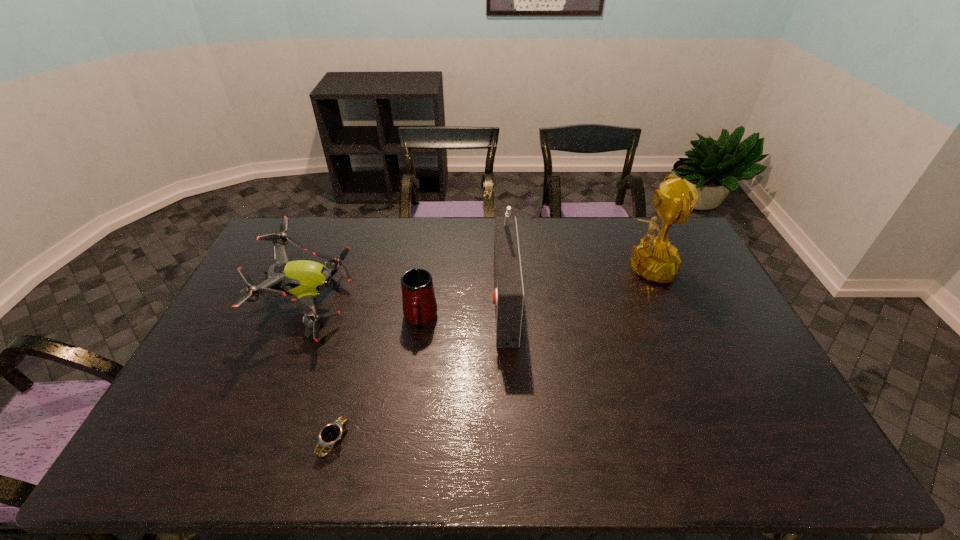
Locate an element on the screen. Image resolution: width=960 pixels, height=540 pixels. vacant area that lies between the nearest object and the mug is located at coordinates (377, 380).

The height and width of the screenshot is (540, 960). Find the location of `free space between the mug and the rightmost object`. free space between the mug and the rightmost object is located at coordinates (532, 293).

Locate an element on the screen. This screenshot has height=540, width=960. empty space that is in between the fourth tallest object and the radio receiver is located at coordinates (462, 309).

Locate an element on the screen. The width and height of the screenshot is (960, 540). empty location between the watch and the leftmost object is located at coordinates (322, 373).

Locate an element on the screen. The width and height of the screenshot is (960, 540). free space between the radio receiver and the fourth tallest object is located at coordinates (462, 309).

Where is `empty space that is in between the third object from left to right and the watch`? The image size is (960, 540). empty space that is in between the third object from left to right and the watch is located at coordinates (377, 380).

The image size is (960, 540). I want to click on free space between the third tallest object and the mug, so click(365, 312).

In order to click on the third closest object to the second object from right to left in this screenshot , I will do `click(331, 433)`.

Identify the location of object that is the second nearest to the third tallest object. Image resolution: width=960 pixels, height=540 pixels. (331, 433).

The height and width of the screenshot is (540, 960). I want to click on vacant region that satisfies the following two spatial constraints: 1. on the front side of the rightmost object; 2. on the side of the mug with the handle, so click(666, 319).